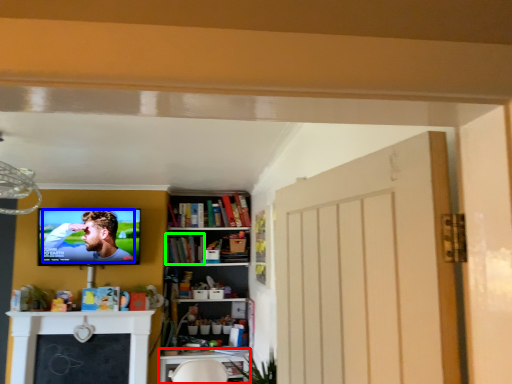
Question: Which object is positioned farthest from table (highlighted by a red box)? Select from person (highlighted by a blue box) and book (highlighted by a green box).

Choices:
 (A) person
 (B) book

Answer: (A)